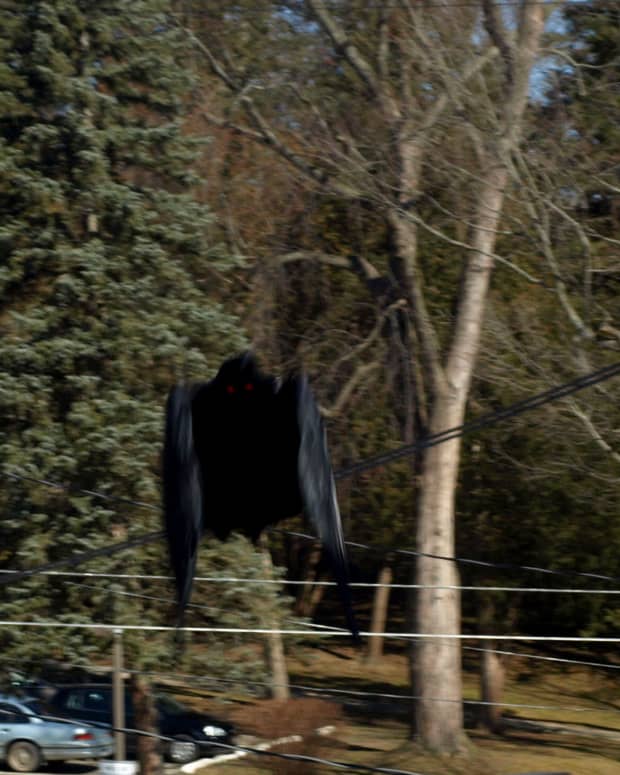
I want to click on wires, so click(435, 439), click(384, 584), click(366, 632).